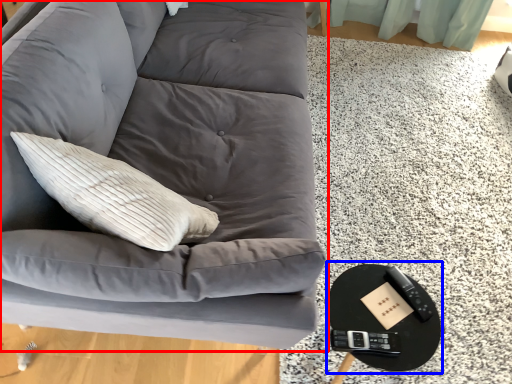
Question: Among these objects, which one is nearest to the camera, studio couch (highlighted by a red box) or round table (highlighted by a blue box)?

Choices:
 (A) studio couch
 (B) round table

Answer: (A)